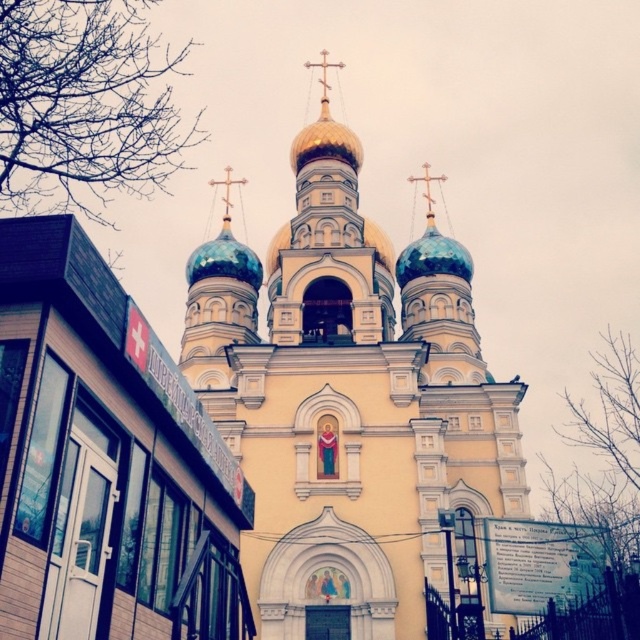
Is blue glossy dome at center to the right of blue glossy dome at upper center from the viewer's perspective?

No, blue glossy dome at center is not to the right of blue glossy dome at upper center.

Which is in front, point (214, 243) or point (403, 276)?

Positioned in front is point (403, 276).

Is point (196, 252) closer to camera compared to point (442, 240)?

No, it is not.

Find the location of `blue glossy dome at center`. blue glossy dome at center is located at coordinates (225, 260).

Who is positioned more to the right, yellow stone church at center or blue glossy dome at center?

yellow stone church at center

I want to click on yellow stone church at center, so click(x=349, y=412).

I want to click on yellow stone church at center, so (349, 412).

Which is above, yellow stone church at center or blue glossy dome at upper center?

blue glossy dome at upper center is higher up.

Can you confirm if yellow stone church at center is shorter than blue glossy dome at upper center?

In fact, yellow stone church at center may be taller than blue glossy dome at upper center.

Between point (381, 349) and point (436, 262), which one is positioned behind?

The point (436, 262) is more distant.

What are the coordinates of `yellow stone church at center` in the screenshot? It's located at (349, 412).